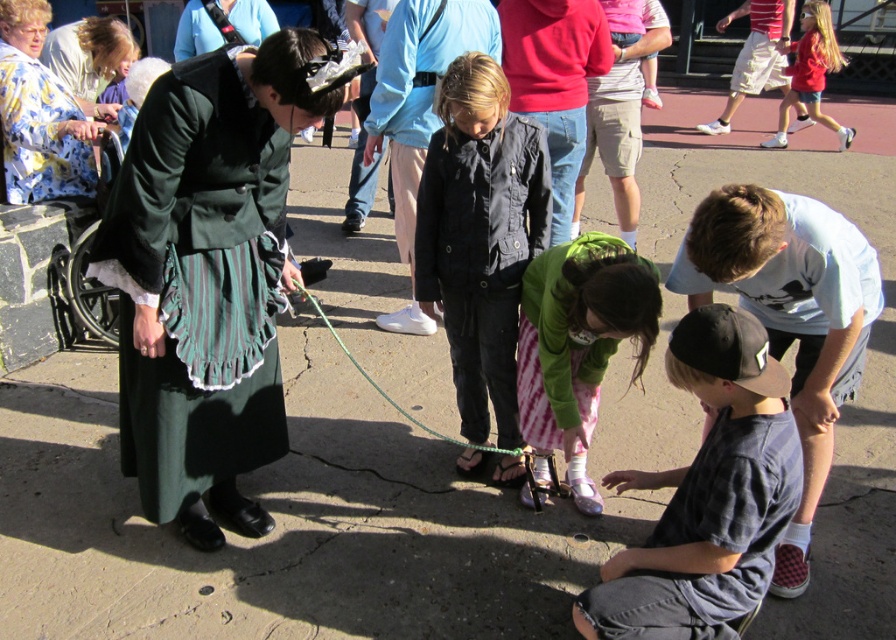
Based on the photo, is light blue t-shirt at lower right smaller than floral silk robe at upper left?

Actually, light blue t-shirt at lower right might be larger than floral silk robe at upper left.

Does light blue t-shirt at lower right have a lesser height compared to floral silk robe at upper left?

Incorrect, light blue t-shirt at lower right's height does not fall short of floral silk robe at upper left's.

Where is `light blue t-shirt at lower right`? light blue t-shirt at lower right is located at coordinates (790, 316).

Find the location of a particular element. green velvet robe at left is located at coordinates (197, 284).

Is point (204, 433) closer to camera compared to point (330, 330)?

Yes, point (204, 433) is closer to viewer.

Which is in front, point (225, 192) or point (306, 292)?

Point (225, 192)

At what (x,y) coordinates should I click in order to perform the action: click on green velvet robe at left. Please return your answer as a coordinate pair (x, y). Image resolution: width=896 pixels, height=640 pixels. Looking at the image, I should click on (197, 284).

Is point (432, 188) more distant than point (324, 321)?

That is False.

Who is positioned more to the right, black matte jacket at center or green rubber rope at center?

black matte jacket at center is more to the right.

Which is behind, point (453, 88) or point (358, 368)?

Point (358, 368)

Locate an element on the screen. black matte jacket at center is located at coordinates (480, 236).